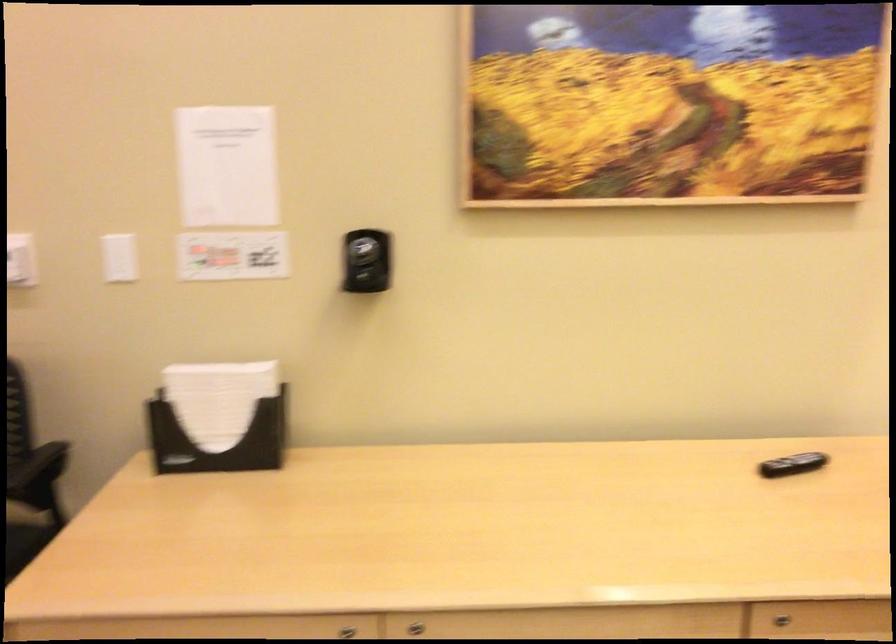
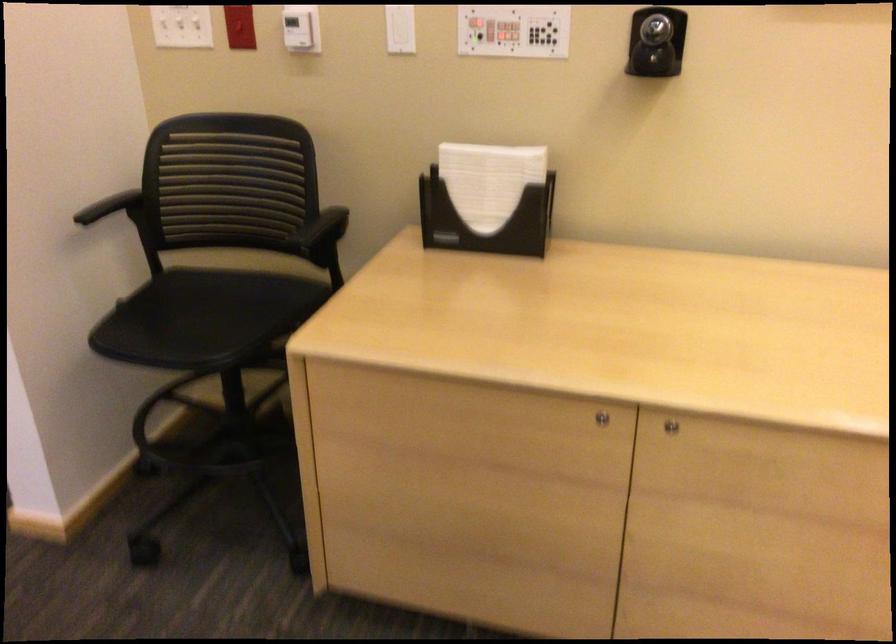
In the second image, find the point that corresponds to (x=115, y=256) in the first image.

(400, 29)